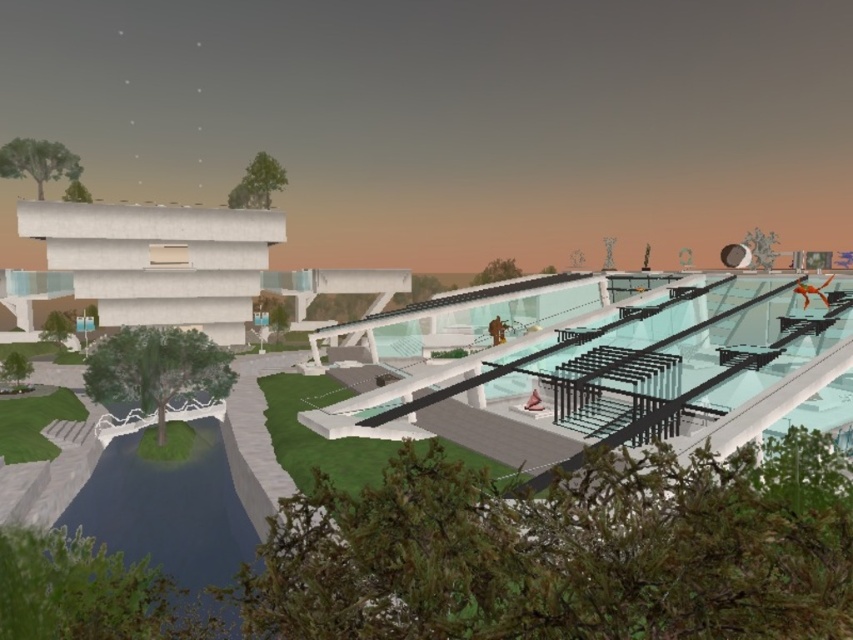
Question: Is clear glass water park at center wider than blue glass pool at lower left?

Choices:
 (A) yes
 (B) no

Answer: (A)

Question: Is clear glass water park at center below blue glass pool at lower left?

Choices:
 (A) yes
 (B) no

Answer: (B)

Question: Can you confirm if clear glass water park at center is thinner than blue glass pool at lower left?

Choices:
 (A) no
 (B) yes

Answer: (A)